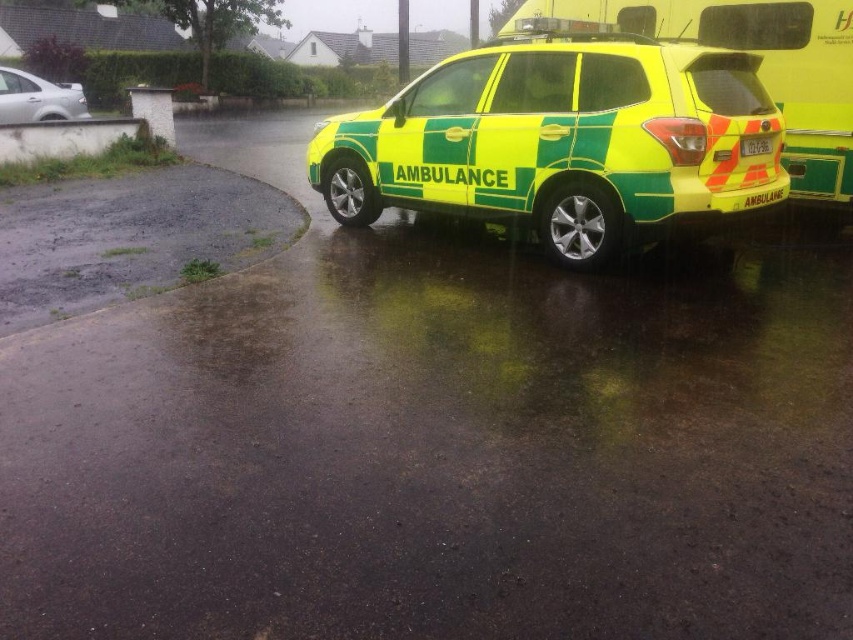
You are standing at the point where the ambulance is parked and want to move to a safe spot 4 meters away from your current position. Is the point at coordinates point [439,128] within the safe distance?

The distance of point [439,128] from viewer is 3.42 meters, so yes, the point at coordinates point 0.200, 0.200 is within the safe distance of 4 meters.